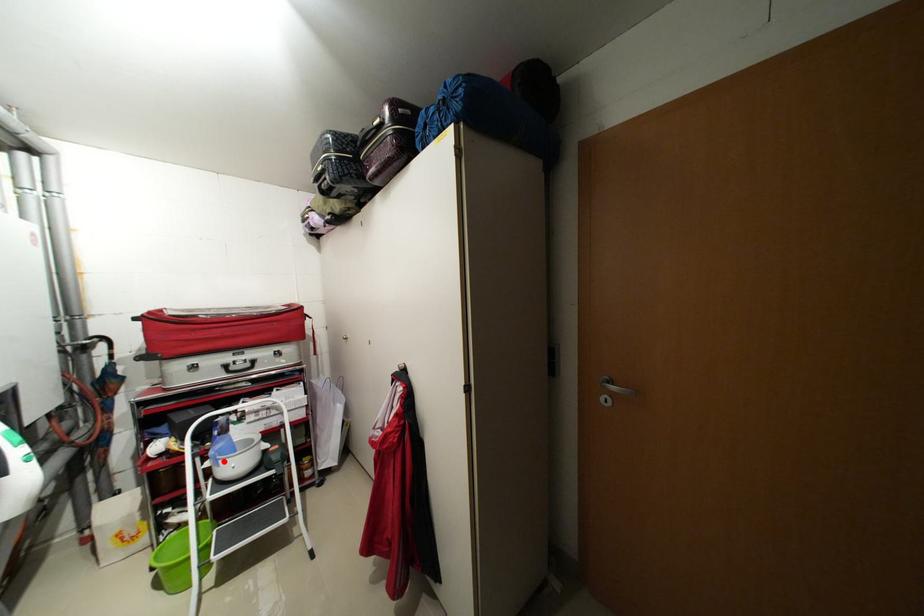
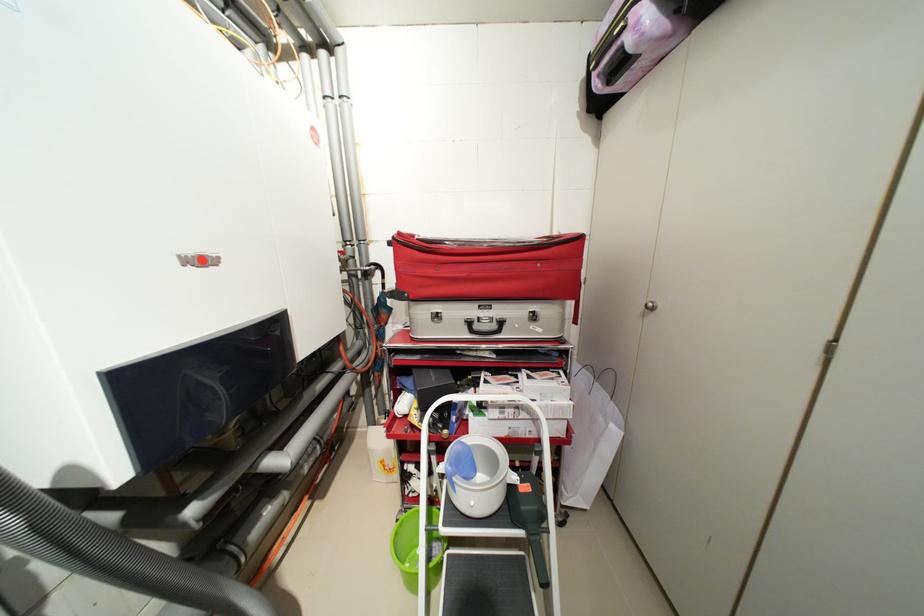
The point at the highlighted location is marked in the first image. Where is the corresponding point in the second image?

(459, 485)